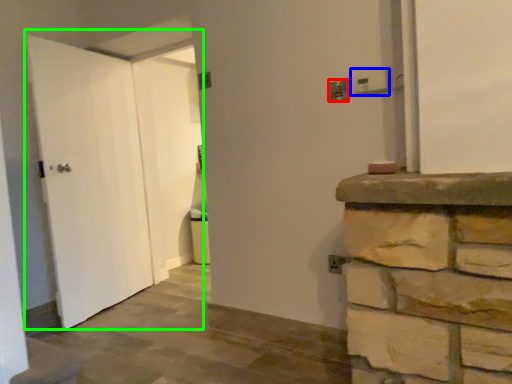
Question: Based on their relative distances, which object is nearer to electric outlet (highlighted by a red box)? Choose from electric outlet (highlighted by a blue box) and door (highlighted by a green box).

Choices:
 (A) electric outlet
 (B) door

Answer: (A)